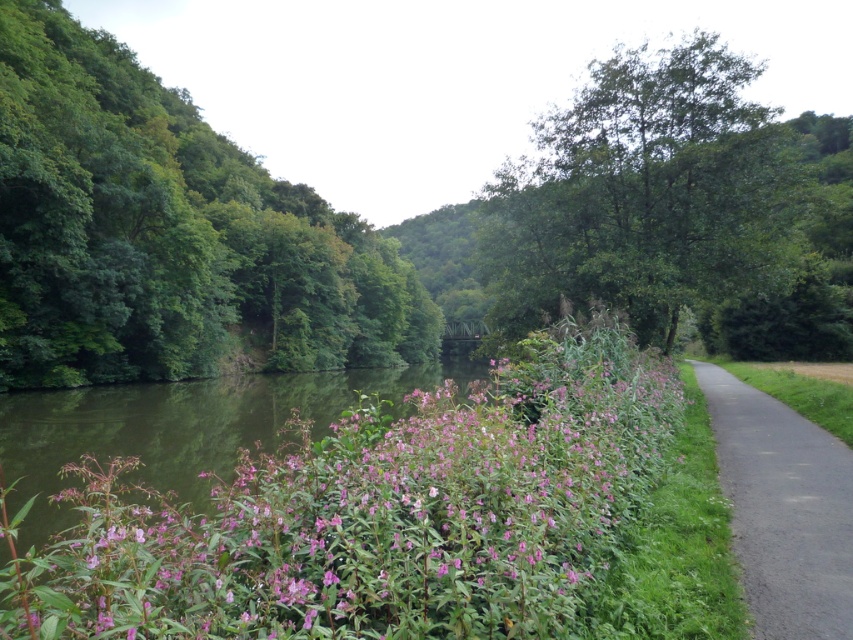
Identify the location of green leafy tree at left. (167, 232).

Does point (28, 1) come closer to viewer compared to point (822, 467)?

No, it is behind (822, 467).

This screenshot has width=853, height=640. I want to click on green leafy tree at left, so click(x=167, y=232).

Is green leafy tree at left taller than green leafy tree at upper center?

Yes.

Consider the image. Between green leafy tree at left and green leafy tree at upper center, which one is positioned lower?

green leafy tree at upper center is below.

Where is `green leafy tree at left`? green leafy tree at left is located at coordinates (167, 232).

Does pink matte flowers at center have a lesser width compared to green leafy tree at upper center?

No.

Is point (593, 467) closer to camera compared to point (572, 243)?

Yes, point (593, 467) is in front of point (572, 243).

This screenshot has height=640, width=853. Find the location of `pink matte flowers at center`. pink matte flowers at center is located at coordinates (375, 516).